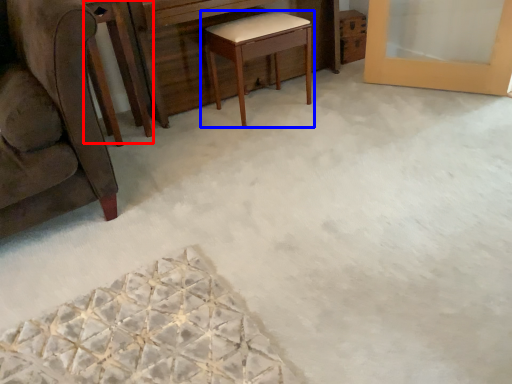
Question: Which object appears closest to the camera in this image, round table (highlighted by a red box) or table (highlighted by a blue box)?

Choices:
 (A) round table
 (B) table

Answer: (A)